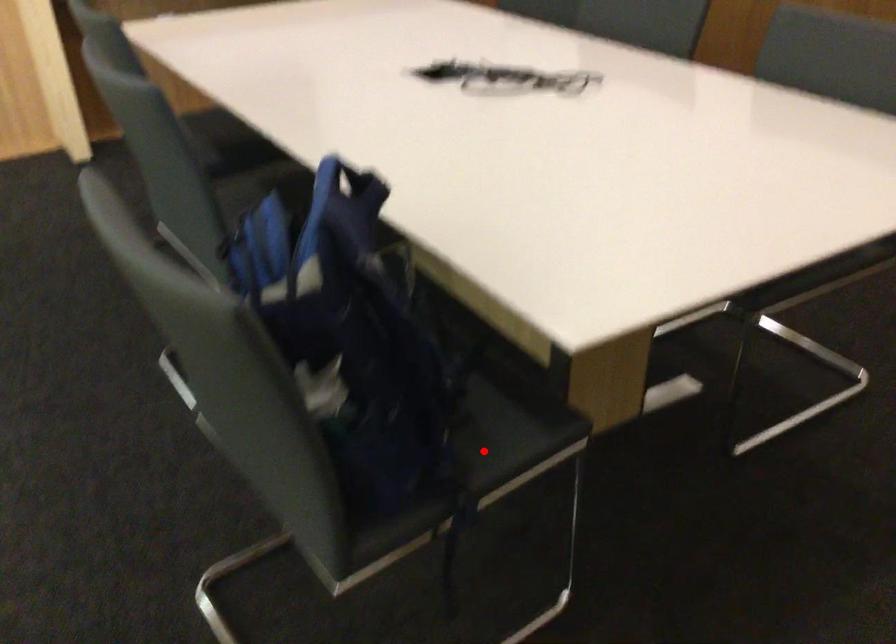
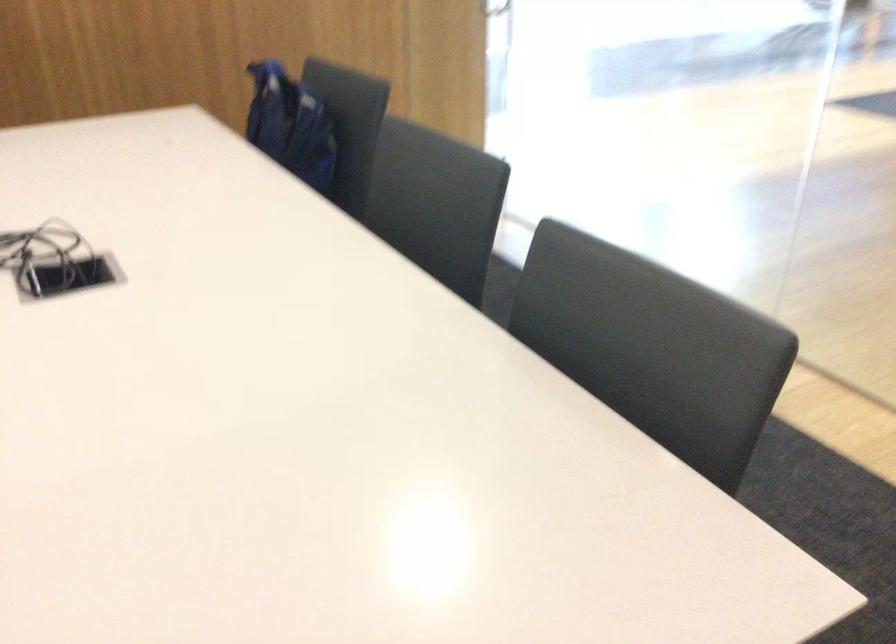
Question: I am providing you with two images of the same scene from different viewpoints. A red point is marked on the first image. Is the red point's position out of view in image 2?

Choices:
 (A) Yes
 (B) No

Answer: (A)